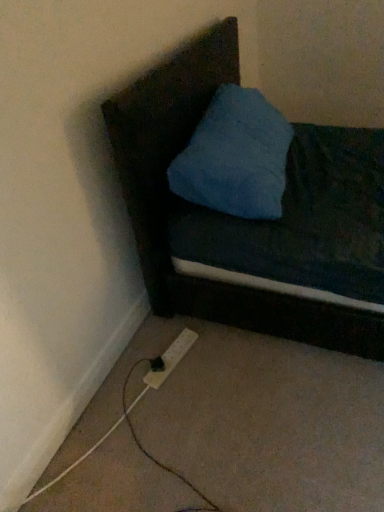
The width and height of the screenshot is (384, 512). I want to click on white plastic power plugs and sockets at lower left, so click(171, 358).

What do you see at coordinates (171, 358) in the screenshot? I see `white plastic power plugs and sockets at lower left` at bounding box center [171, 358].

Find the location of a particular element. The height and width of the screenshot is (512, 384). white plastic power plugs and sockets at lower left is located at coordinates (171, 358).